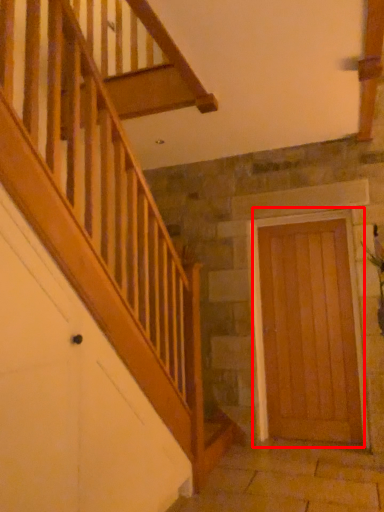
Question: Considering the relative positions of door (annotated by the red box) and plant in the image provided, where is door (annotated by the red box) located with respect to the staircase?

Choices:
 (A) left
 (B) right

Answer: (A)